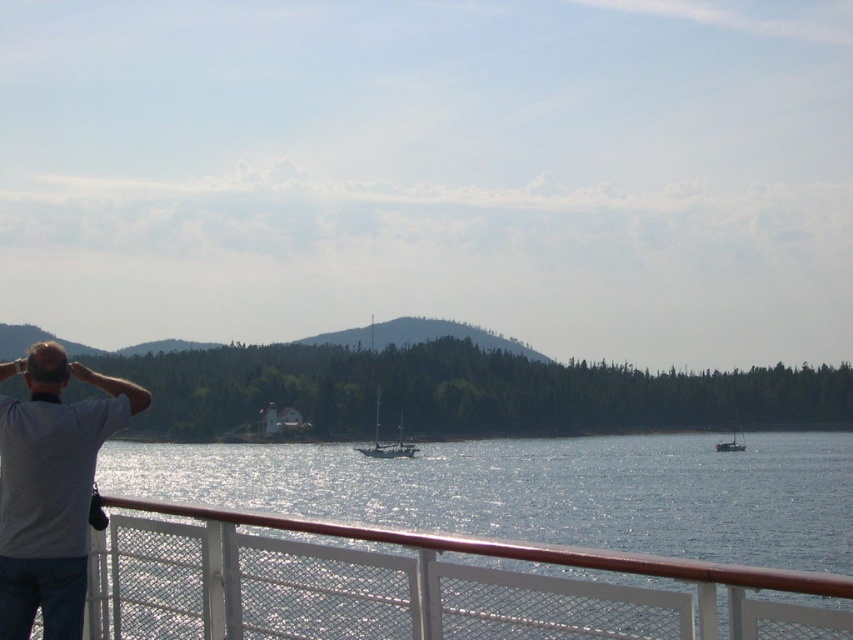
Question: Which object appears closest to the camera in this image?

Choices:
 (A) shiny black sailboat at right
 (B) shiny silver sailboat at center
 (C) white glossy sailboat at center
 (D) clear water at lower center

Answer: (D)

Question: Does shiny silver sailboat at center appear on the right side of shiny black sailboat at right?

Choices:
 (A) no
 (B) yes

Answer: (A)

Question: Which object appears closest to the camera in this image?

Choices:
 (A) clear water at lower center
 (B) shiny black sailboat at right
 (C) white glossy sailboat at center

Answer: (A)

Question: Which object appears closest to the camera in this image?

Choices:
 (A) white glossy sailboat at center
 (B) shiny silver sailboat at center
 (C) shiny black sailboat at right
 (D) gray cotton shirt at left

Answer: (D)

Question: Does clear water at lower center come behind gray cotton shirt at left?

Choices:
 (A) no
 (B) yes

Answer: (A)

Question: Is shiny black sailboat at right wider than white glossy sailboat at center?

Choices:
 (A) no
 (B) yes

Answer: (B)